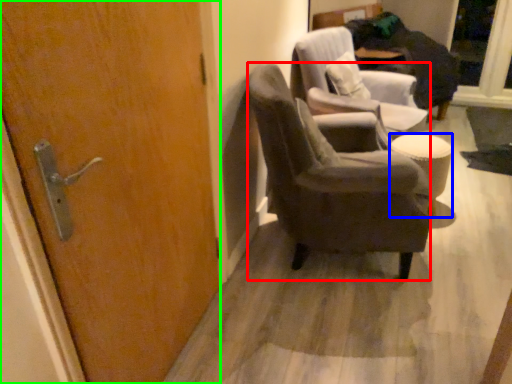
Question: Considering the real-world distances, which object is farthest from chair (highlighted by a red box)? stool (highlighted by a blue box) or door (highlighted by a green box)?

Choices:
 (A) stool
 (B) door

Answer: (B)